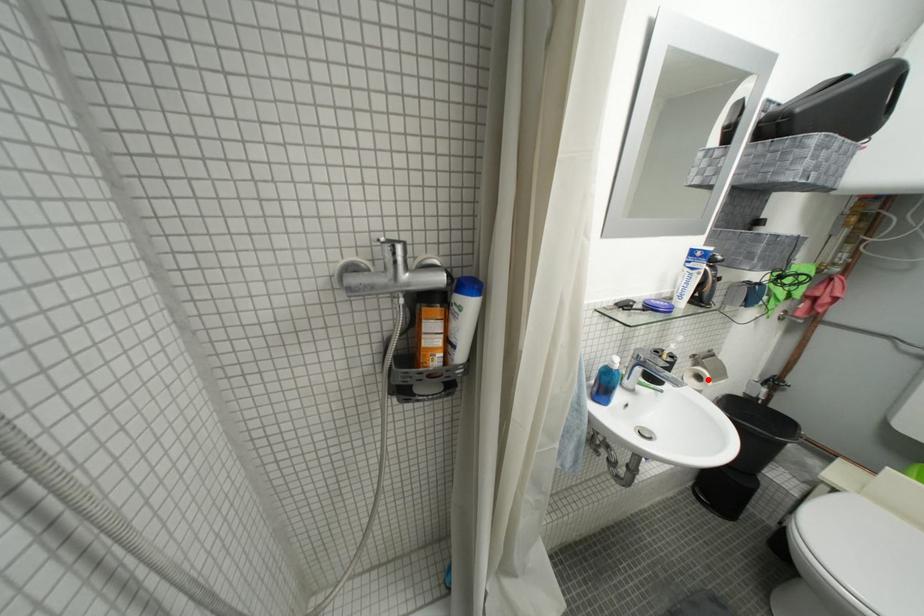
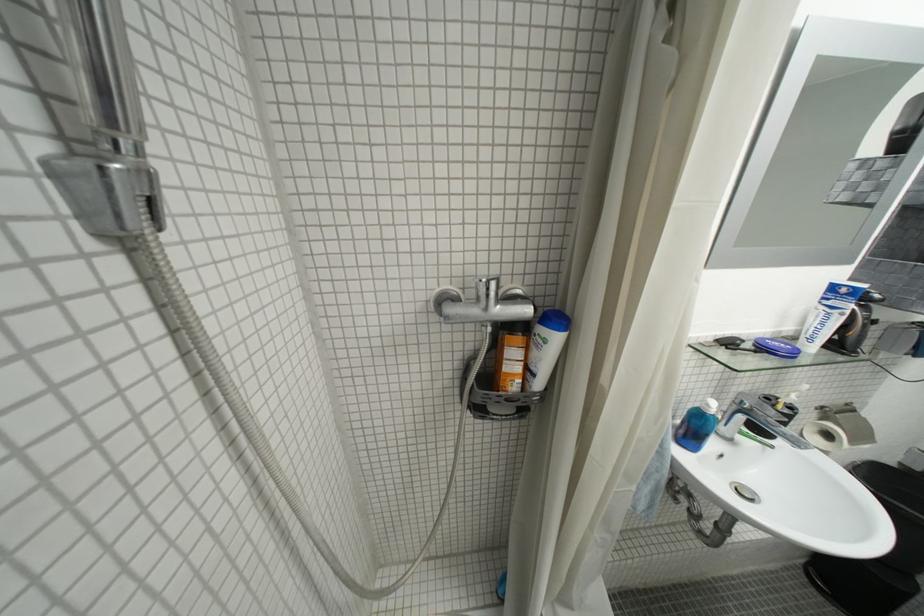
Question: I am providing you with two images of the same scene from different viewpoints. Image1 has a red point marked. In image2, the corresponding 3D location appears at what relative position? Reply with the corresponding letter.

Choices:
 (A) Closer
 (B) Farther

Answer: (A)